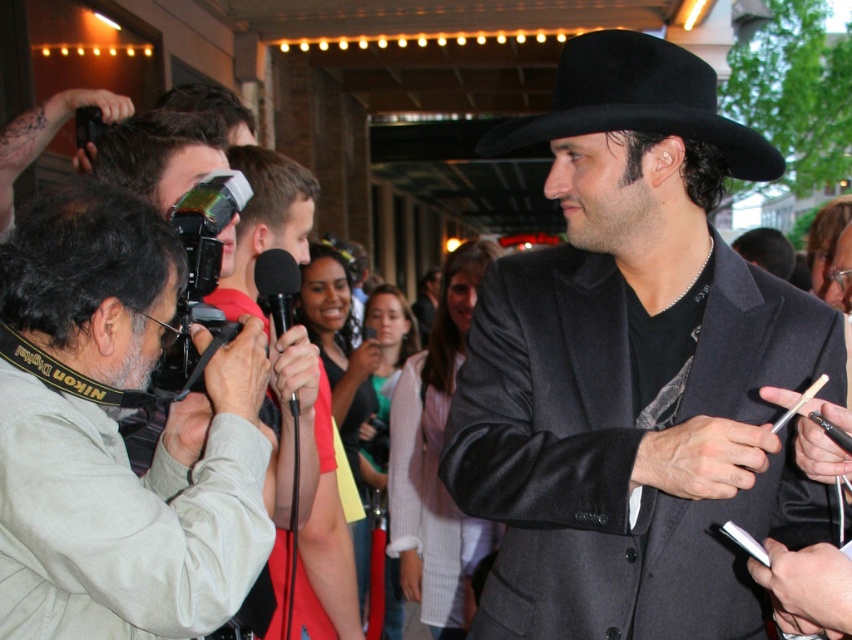
You are a photographer at the event and need to choose between the gray fabric camera at left and the black plastic video camera at left. Which one is taller?

The gray fabric camera at left is much taller than the black plastic video camera at left.